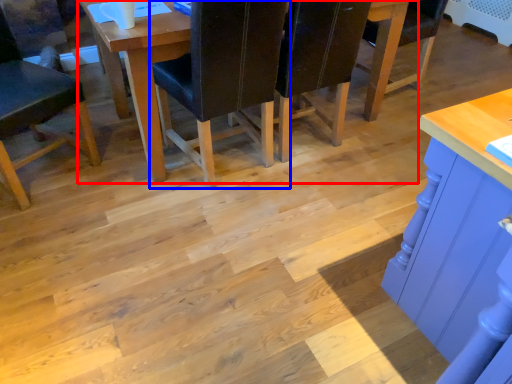
Question: Which of the following is the closest to the observer, table (highlighted by a red box) or chair (highlighted by a blue box)?

Choices:
 (A) table
 (B) chair

Answer: (B)